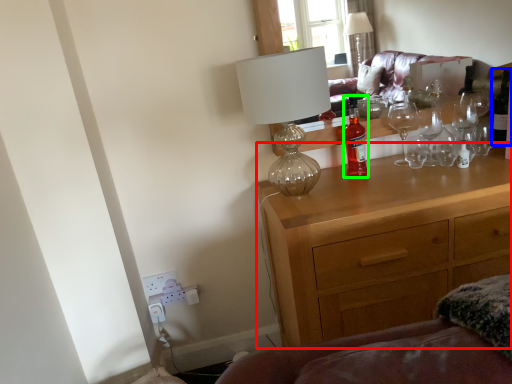
Question: Based on their relative distances, which object is farther from chest of drawers (highlighted by a red box)? Choose from wine bottle (highlighted by a blue box) and bottle (highlighted by a green box).

Choices:
 (A) wine bottle
 (B) bottle

Answer: (A)